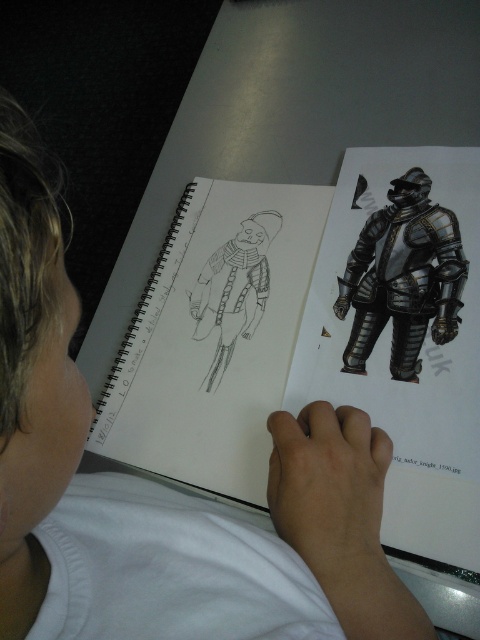
You are a photographer standing at the camera position. You want to take a closeup photo of the point at coordinate point (273, 250). The camera has a focal length of 50mm. What is the minimum distance you need to move forward to focus on this point?

The point at coordinate point (273, 250) is 65.89 centimeters from the camera. To focus on this point with a 50mm focal length, you need to move the camera closer until the distance is within the camera sensor and lens system focusing range. However, without specific focusing limits, the exact distance cannot be calculated. But based on standard focusing, you might need to adjust to be within the minimum focusing distance of the lens, typically around 40cm for many lenses. If the current distance is 65.89